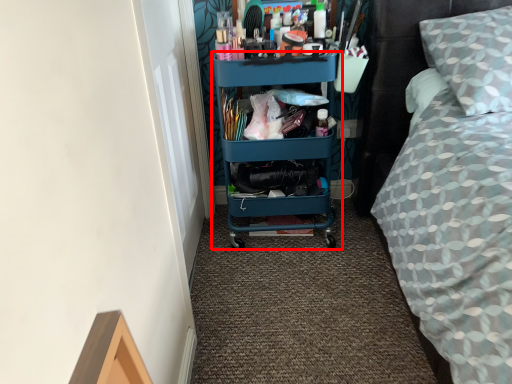
Question: Observing the image, what is the correct spatial positioning of shelf (annotated by the red box) in reference to bed?

Choices:
 (A) left
 (B) right

Answer: (A)